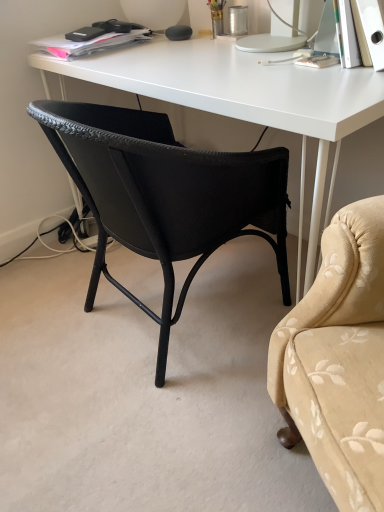
Question: Is matte black charger at upper left completely or partially outside of black woven chair at center?

Choices:
 (A) yes
 (B) no

Answer: (A)

Question: Considering the relative sizes of matte black charger at upper left and black woven chair at center in the image provided, is matte black charger at upper left wider than black woven chair at center?

Choices:
 (A) no
 (B) yes

Answer: (A)

Question: Is matte black charger at upper left thinner than black woven chair at center?

Choices:
 (A) no
 (B) yes

Answer: (B)

Question: Considering the relative sizes of matte black charger at upper left and black woven chair at center in the image provided, is matte black charger at upper left taller than black woven chair at center?

Choices:
 (A) yes
 (B) no

Answer: (B)

Question: Considering the relative positions of matte black charger at upper left and black woven chair at center in the image provided, is matte black charger at upper left behind black woven chair at center?

Choices:
 (A) yes
 (B) no

Answer: (A)

Question: From a real-world perspective, is white matte desk at center positioned above or below black woven chair at center?

Choices:
 (A) above
 (B) below

Answer: (A)

Question: Looking at their shapes, would you say white matte desk at center is wider or thinner than black woven chair at center?

Choices:
 (A) wide
 (B) thin

Answer: (A)

Question: Would you say white matte desk at center is inside or outside black woven chair at center?

Choices:
 (A) outside
 (B) inside

Answer: (A)

Question: From their relative heights in the image, would you say white matte desk at center is taller or shorter than black woven chair at center?

Choices:
 (A) short
 (B) tall

Answer: (B)

Question: In the image, is black woven chair at center on the left side or the right side of white matte desk at center?

Choices:
 (A) right
 (B) left

Answer: (B)

Question: Is black woven chair at center in front of or behind white matte desk at center in the image?

Choices:
 (A) front
 (B) behind

Answer: (A)

Question: From a real-world perspective, relative to white matte desk at center, is black woven chair at center vertically above or below?

Choices:
 (A) above
 (B) below

Answer: (B)

Question: Considering the positions of black woven chair at center and white matte desk at center in the image, is black woven chair at center taller or shorter than white matte desk at center?

Choices:
 (A) short
 (B) tall

Answer: (A)

Question: From a real-world perspective, is white matte desk at center positioned above or below matte black charger at upper left?

Choices:
 (A) above
 (B) below

Answer: (B)

Question: From the image's perspective, is white matte desk at center above or below matte black charger at upper left?

Choices:
 (A) above
 (B) below

Answer: (B)